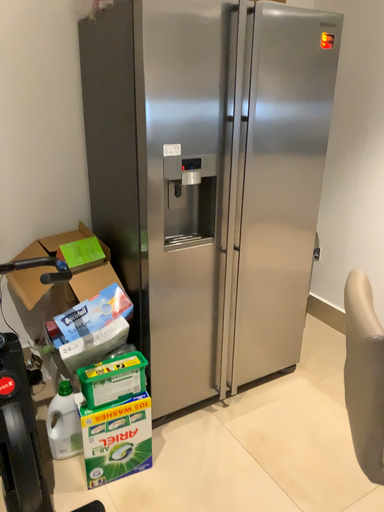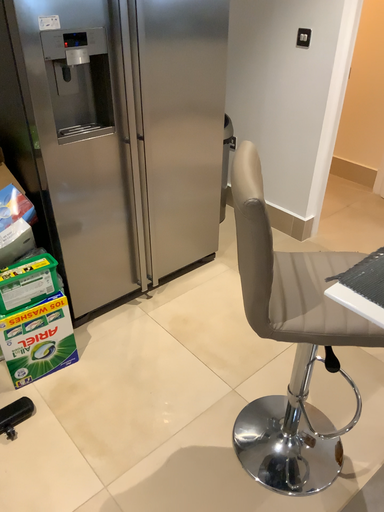
Question: Which way did the camera rotate in the video?

Choices:
 (A) rotated downward
 (B) rotated upward

Answer: (A)